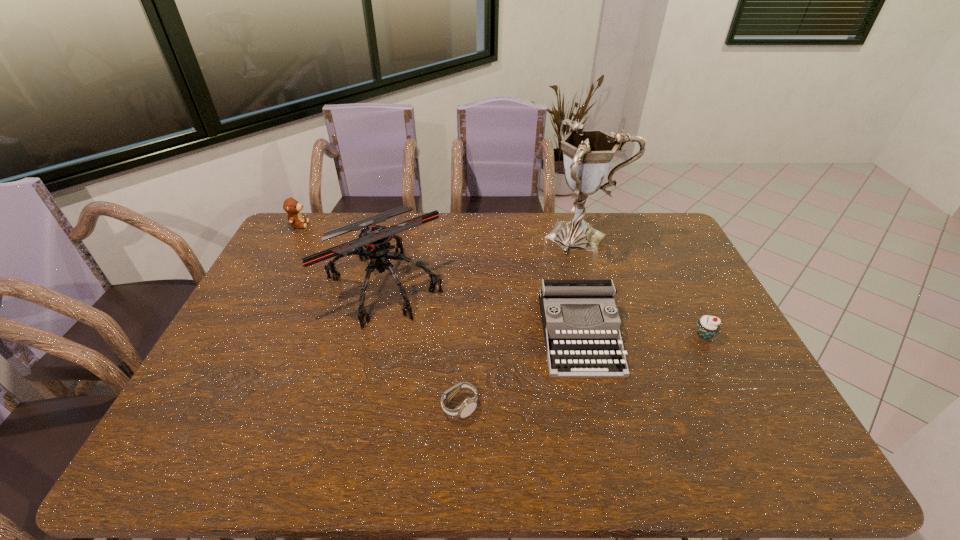
Where is `free space located 0.300m on the face of the teddy bear`? free space located 0.300m on the face of the teddy bear is located at coordinates (387, 225).

The image size is (960, 540). In order to click on blank area located on the typing side of the typewriter in this screenshot , I will do `click(605, 446)`.

Find the location of `blank area located on the front of the cupcake`. blank area located on the front of the cupcake is located at coordinates (724, 373).

Find the location of a particular element. The width and height of the screenshot is (960, 540). vacant region located 0.080m on the face of the shortest object is located at coordinates (510, 406).

You are a GUI agent. You are given a task and a screenshot of the screen. Output one action in this format:
    pyautogui.click(x=<x>, y=<y>)
    Task: Click on the trophy cup at the far edge
    This screenshot has width=960, height=540.
    Given the screenshot: What is the action you would take?
    pyautogui.click(x=588, y=154)

Locate an element on the screen. drone located in the far edge section of the desktop is located at coordinates (376, 239).

In order to click on teddy bear located at the far edge in this screenshot , I will do `click(291, 206)`.

Image resolution: width=960 pixels, height=540 pixels. Find the location of `object that is at the left edge`. object that is at the left edge is located at coordinates (291, 206).

Locate an element on the screen. object that is at the right edge is located at coordinates (707, 326).

I want to click on object that is positioned at the far left corner, so click(x=291, y=206).